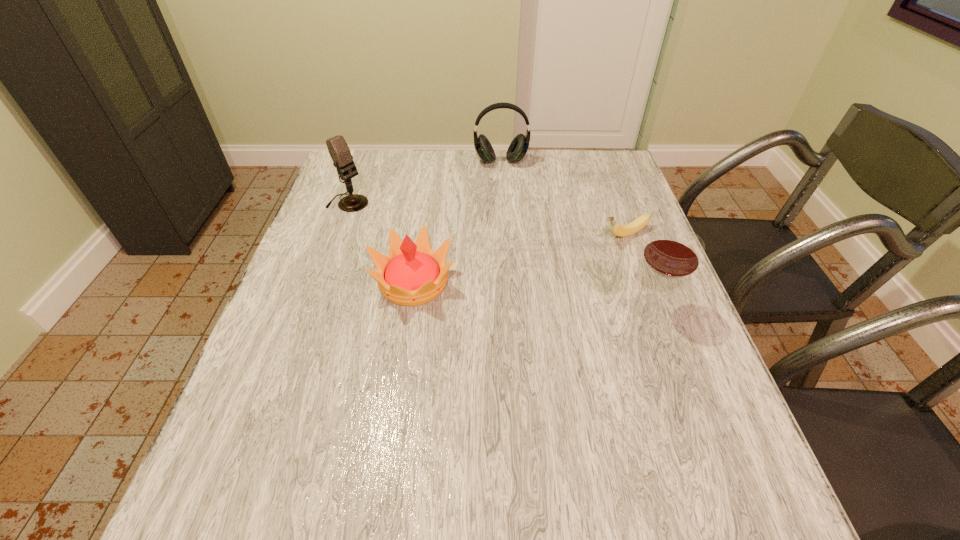
This screenshot has width=960, height=540. Identify the location of object that is the fourth closest to the banana. (339, 151).

This screenshot has width=960, height=540. I want to click on object identified as the fourth closest to the wineglass, so click(x=339, y=151).

The height and width of the screenshot is (540, 960). What are the coordinates of `vacant space that satisfies the following two spatial constraints: 1. on the front side of the farthest object; 2. on the left side of the wineglass` in the screenshot? It's located at (510, 306).

The height and width of the screenshot is (540, 960). I want to click on free space in the image that satisfies the following two spatial constraints: 1. on the front side of the fourth nearest object; 2. on the right side of the third farthest object, so click(x=337, y=234).

Identify the location of vacant area in the image that satisfies the following two spatial constraints: 1. on the front side of the banana; 2. on the right side of the microphone. The width and height of the screenshot is (960, 540). (337, 234).